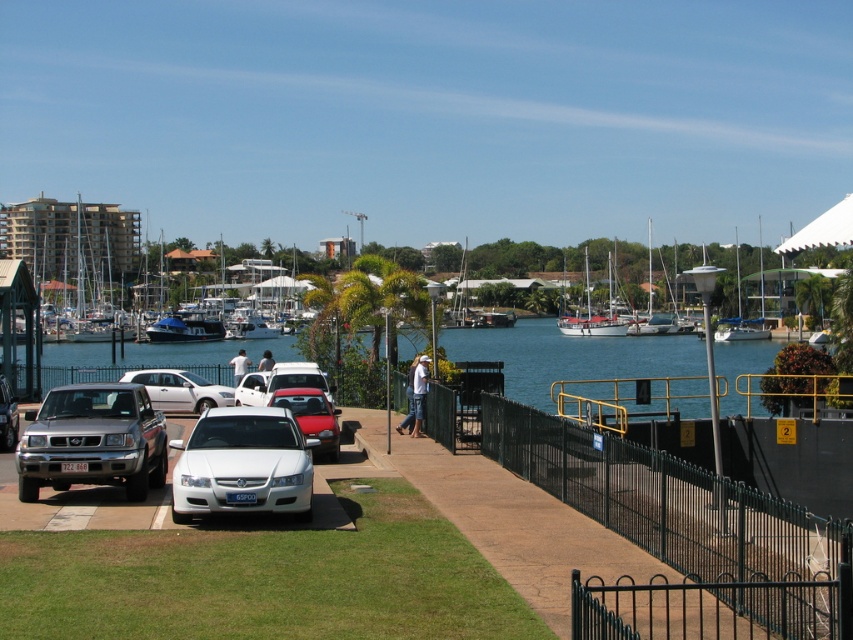
Question: Can you confirm if white cotton shirt at center is positioned to the left of white fabric shirt at center?

Choices:
 (A) no
 (B) yes

Answer: (A)

Question: Can you confirm if metallic red car at center is smaller than white cotton shirt at center?

Choices:
 (A) no
 (B) yes

Answer: (A)

Question: Which object is positioned closest to the metallic red car at center?

Choices:
 (A) white fabric shirt at center
 (B) white cotton shirt at center

Answer: (B)

Question: Which object is farther from the camera taking this photo?

Choices:
 (A) white matte sedan at center
 (B) white wooden sailboat at center

Answer: (B)

Question: Among these points, which one is farthest from the camera?

Choices:
 (A) (445, 390)
 (B) (608, 336)

Answer: (B)

Question: Is silver metallic suv at lower left below silver metallic suv at center left?

Choices:
 (A) no
 (B) yes

Answer: (A)